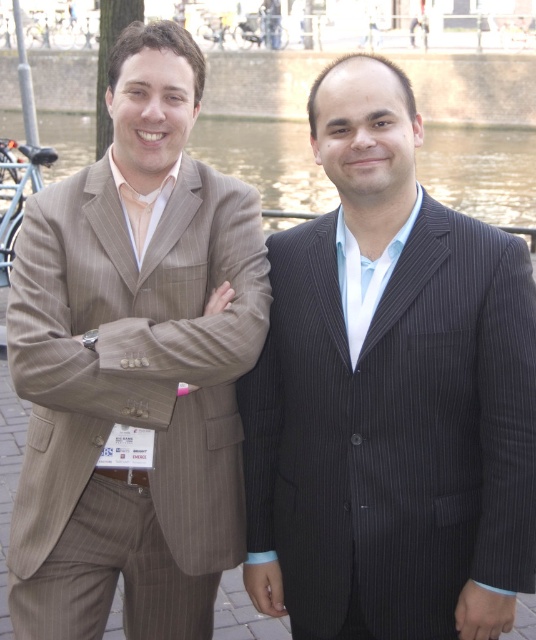
Describe the element at coordinates (390, 396) in the screenshot. I see `dark pinstripe suit at center` at that location.

Does dark pinstripe suit at center have a lesser height compared to brown pinstripe suit at left?

Correct, dark pinstripe suit at center is not as tall as brown pinstripe suit at left.

What do you see at coordinates (390, 396) in the screenshot? I see `dark pinstripe suit at center` at bounding box center [390, 396].

Where is `dark pinstripe suit at center`? The height and width of the screenshot is (640, 536). dark pinstripe suit at center is located at coordinates (390, 396).

Between point (348, 547) and point (502, 156), which one is positioned in front?

Positioned in front is point (348, 547).

The image size is (536, 640). Describe the element at coordinates (390, 396) in the screenshot. I see `dark pinstripe suit at center` at that location.

Where is `dark pinstripe suit at center`? This screenshot has width=536, height=640. dark pinstripe suit at center is located at coordinates (390, 396).

In order to click on dark pinstripe suit at center in this screenshot , I will do `click(390, 396)`.

Which is in front, point (121, 493) or point (196, 148)?

Point (121, 493)

Can you confirm if brown pinstripe suit at left is taller than transparent water at center?

In fact, brown pinstripe suit at left may be shorter than transparent water at center.

Find the location of a particular element. The height and width of the screenshot is (640, 536). brown pinstripe suit at left is located at coordinates (134, 364).